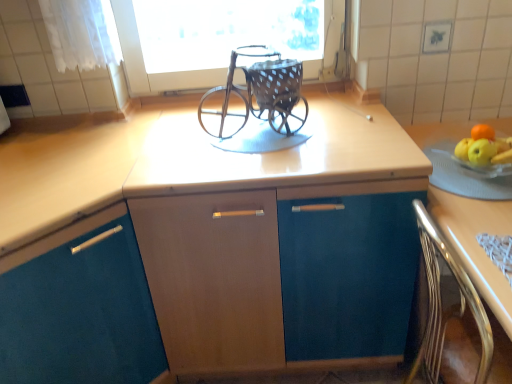
Where is `free space in front of rustic metal baby carriage at center`? This screenshot has height=384, width=512. free space in front of rustic metal baby carriage at center is located at coordinates (259, 164).